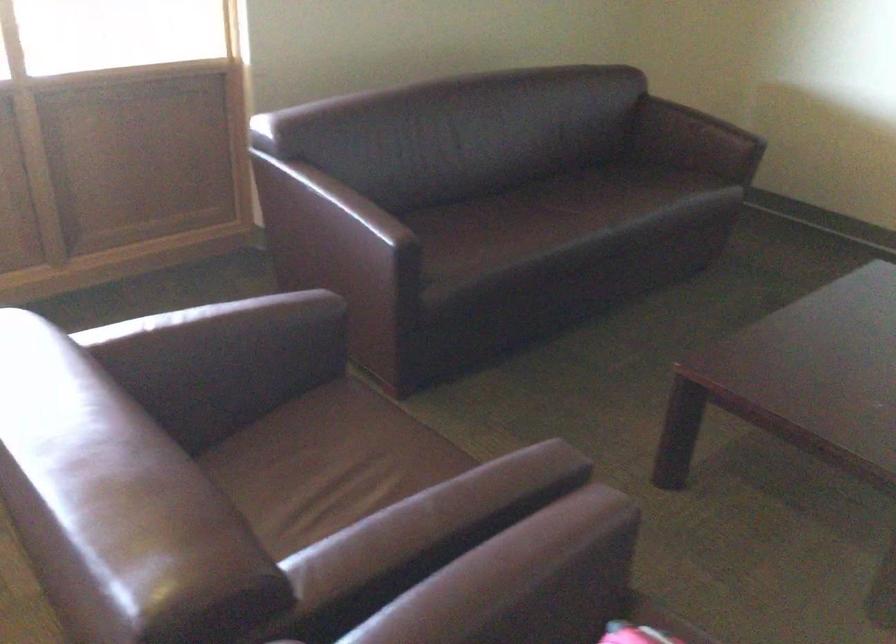
Identify the location of chair armrest. Image resolution: width=896 pixels, height=644 pixels. (883, 569).